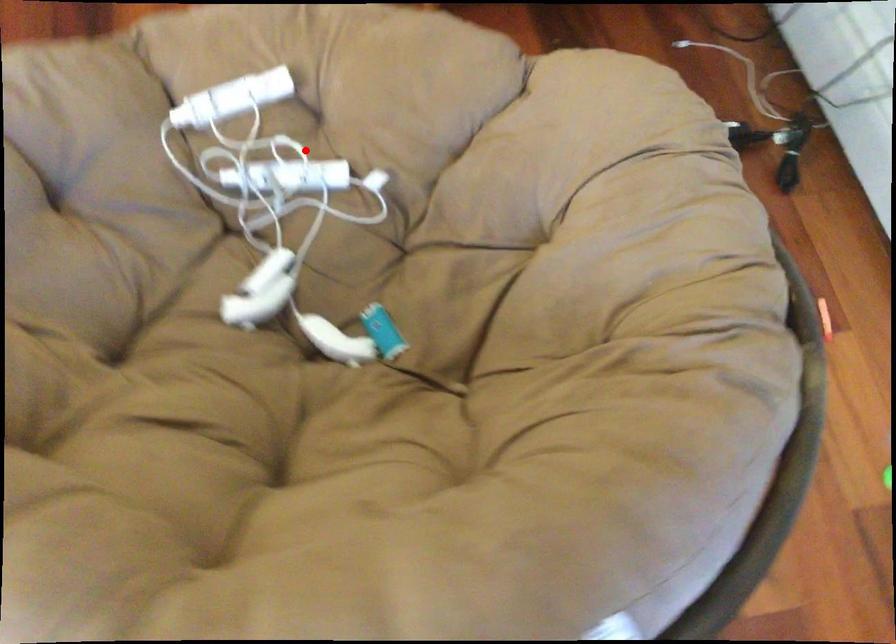
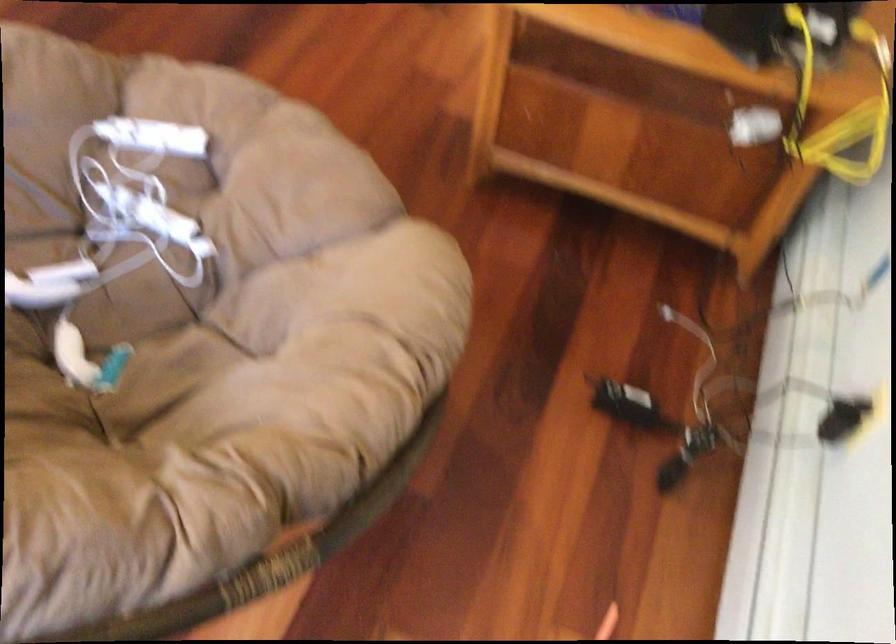
Find the pixel in the second image that matches the highlighted location in the first image.

(181, 205)